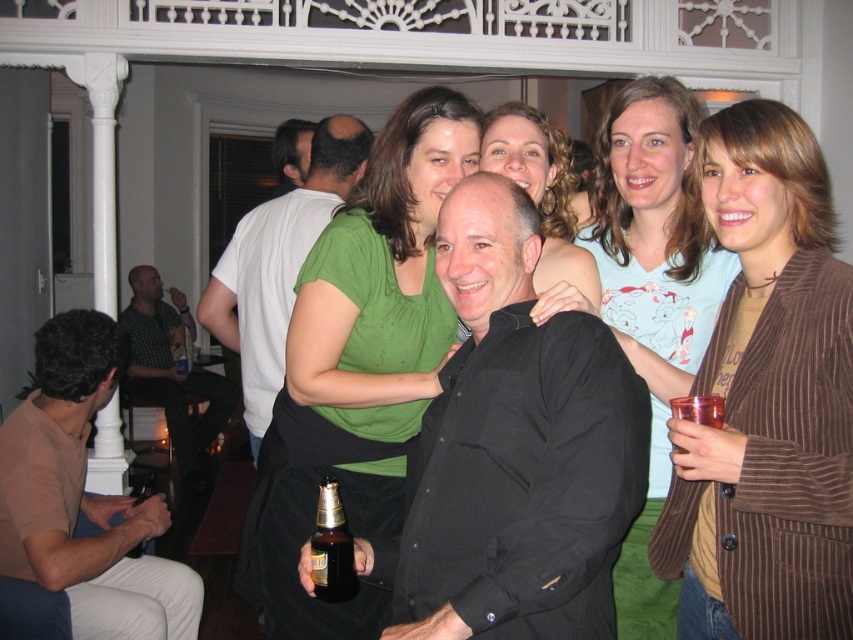
You are at a party and want to grab a drink from the translucent plastic cup at upper right without bumping into the person in the white matte shirt at center. Which direction should you move to reach the cup?

The white matte shirt at center is to the left of the translucent plastic cup at upper right, so you should move to the right to reach the cup without bumping into the person.

You are at a party and want to grab the brown glass bottle at center without touching the brown cotton shirt at lower left. Is the bottle easy to reach?

The brown cotton shirt at lower left is larger than the brown glass bottle at center, so there might be enough space to reach the bottle without touching the shirt.

You are at a party and want to grab a drink. You see the brown glass bottle at center and the matte white shirt at upper left. Which one is smaller in size?

The brown glass bottle at center has a smaller size compared to the matte white shirt at upper left, so the brown glass bottle at center is smaller.